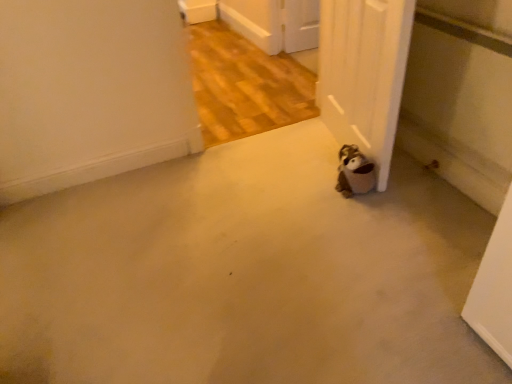
Where is `empty space that is ontop of beige carpet at lower center (from a real-world perspective)`? This screenshot has height=384, width=512. empty space that is ontop of beige carpet at lower center (from a real-world perspective) is located at coordinates (232, 266).